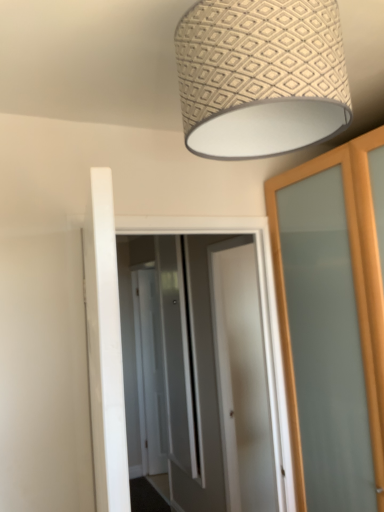
Question: Should I look upward or downward to see white glossy door at center, arranged as the 1th screen door when viewed from the front?

Choices:
 (A) down
 (B) up

Answer: (A)

Question: Is white glossy door at center, which is counted as the 3th screen door, starting from the front, at the right side of patterned fabric lampshade at upper center?

Choices:
 (A) no
 (B) yes

Answer: (A)

Question: Does white glossy door at center, which is counted as the 3th screen door, starting from the front, have a larger size compared to patterned fabric lampshade at upper center?

Choices:
 (A) no
 (B) yes

Answer: (B)

Question: From the image's perspective, does white glossy door at center, acting as the first screen door starting from the back, appear lower than patterned fabric lampshade at upper center?

Choices:
 (A) yes
 (B) no

Answer: (A)

Question: From the image's perspective, is white glossy door at center, acting as the first screen door starting from the back, located above patterned fabric lampshade at upper center?

Choices:
 (A) no
 (B) yes

Answer: (A)

Question: Can you confirm if white glossy door at center, which is counted as the 3th screen door, starting from the front, is thinner than patterned fabric lampshade at upper center?

Choices:
 (A) yes
 (B) no

Answer: (A)

Question: Is white glossy door at center, acting as the first screen door starting from the back, beside patterned fabric lampshade at upper center?

Choices:
 (A) no
 (B) yes

Answer: (A)

Question: Is white glossy door at center, the 3th screen door when ordered from back to front, at the right side of white glossy door at center, acting as the first screen door starting from the back?

Choices:
 (A) no
 (B) yes

Answer: (B)

Question: Is white glossy door at center, which is counted as the 3th screen door, starting from the front, at the back of white glossy door at center, arranged as the 1th screen door when viewed from the front?

Choices:
 (A) no
 (B) yes

Answer: (A)

Question: From a real-world perspective, is white glossy door at center, arranged as the 1th screen door when viewed from the front, under white glossy door at center, acting as the first screen door starting from the back?

Choices:
 (A) yes
 (B) no

Answer: (B)

Question: Considering the relative sizes of white glossy door at center, the 3th screen door when ordered from back to front, and white glossy door at center, which is counted as the 3th screen door, starting from the front, in the image provided, is white glossy door at center, the 3th screen door when ordered from back to front, thinner than white glossy door at center, which is counted as the 3th screen door, starting from the front,?

Choices:
 (A) no
 (B) yes

Answer: (A)

Question: Does white glossy door at center, the 3th screen door when ordered from back to front, have a lesser height compared to white glossy door at center, which is counted as the 3th screen door, starting from the front?

Choices:
 (A) yes
 (B) no

Answer: (A)

Question: Considering the relative positions of white glossy door at center, arranged as the 1th screen door when viewed from the front, and white glossy door at center, which is counted as the 3th screen door, starting from the front, in the image provided, is white glossy door at center, arranged as the 1th screen door when viewed from the front, behind white glossy door at center, which is counted as the 3th screen door, starting from the front,?

Choices:
 (A) no
 (B) yes

Answer: (A)

Question: Is there a large distance between white glossy door at center, the 3th screen door when ordered from back to front, and patterned fabric lampshade at upper center?

Choices:
 (A) yes
 (B) no

Answer: (A)